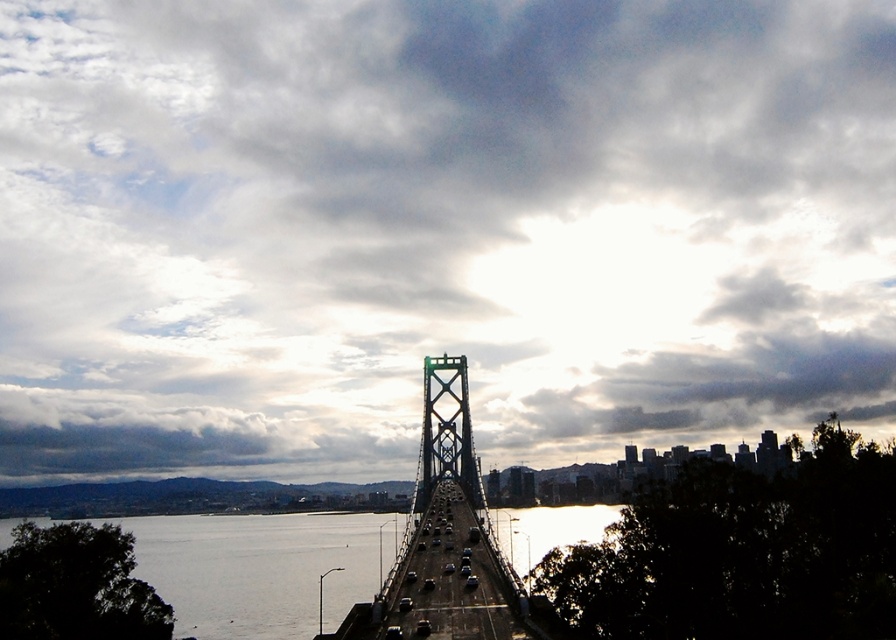
Question: Which point is closer to the camera?

Choices:
 (A) silvery water at center
 (B) green metallic suspension bridge at center

Answer: (B)

Question: In this image, where is silvery water at center located relative to green metallic suspension bridge at center?

Choices:
 (A) above
 (B) below

Answer: (B)

Question: In this image, where is silvery water at center located relative to green metallic suspension bridge at center?

Choices:
 (A) below
 (B) above

Answer: (A)

Question: Does silvery water at center appear on the left side of green metallic suspension bridge at center?

Choices:
 (A) no
 (B) yes

Answer: (B)

Question: Among these objects, which one is nearest to the camera?

Choices:
 (A) silvery water at center
 (B) green metallic suspension bridge at center

Answer: (B)

Question: Among these objects, which one is nearest to the camera?

Choices:
 (A) green metallic suspension bridge at center
 (B) silvery water at center

Answer: (A)